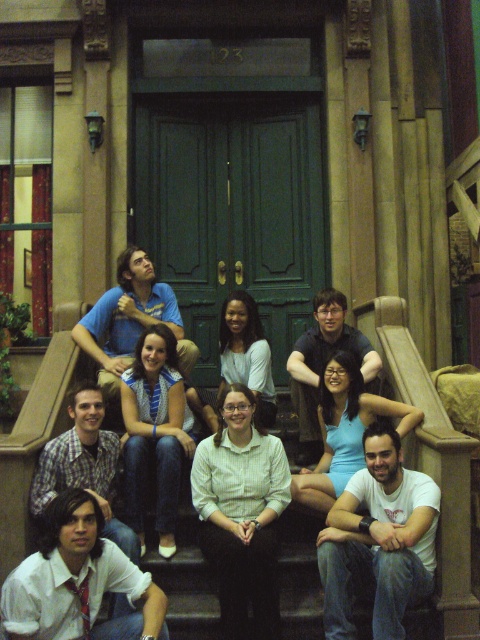
You are standing at the point with coordinates (240, 513) in the image. What object are you currently located on?

The point with coordinates (240, 513) is located on the white glossy shirt at center.

Looking at this image, you are standing at the position of point (60, 618) and want to walk to the entrance of the building. There is a point at (277, 499) in your path. Can you walk straight ahead without changing direction?

Point (277, 499) is behind point (60, 618), so you can walk straight ahead without changing direction because the point (277, 499) is not in front of you on your path to the entrance.